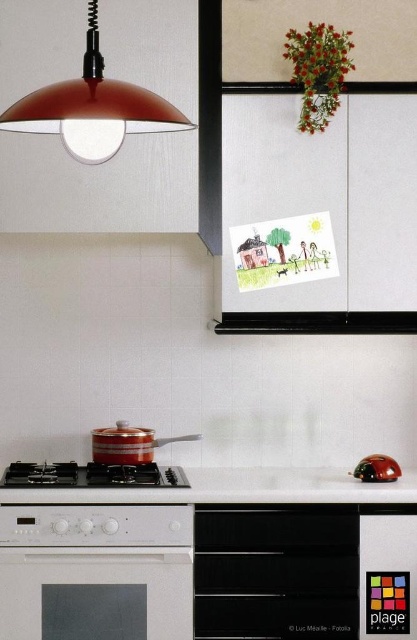
You are a chef preparing to place the metallic red ladybug at lower right on top of the black matte oven at lower center. Based on the oven and ladybug sizes, will the ladybug fit securely on the oven without falling off?

The black matte oven at lower center has a greater height compared to the metallic red ladybug at lower right. Since the oven is taller, the ladybug can be placed on top securely as it won

You are standing in the kitchen and need to locate the black matte gas stove at lower center. According to the scene description, where exactly is it positioned?

The black matte gas stove at lower center is positioned at point (x=92, y=474).